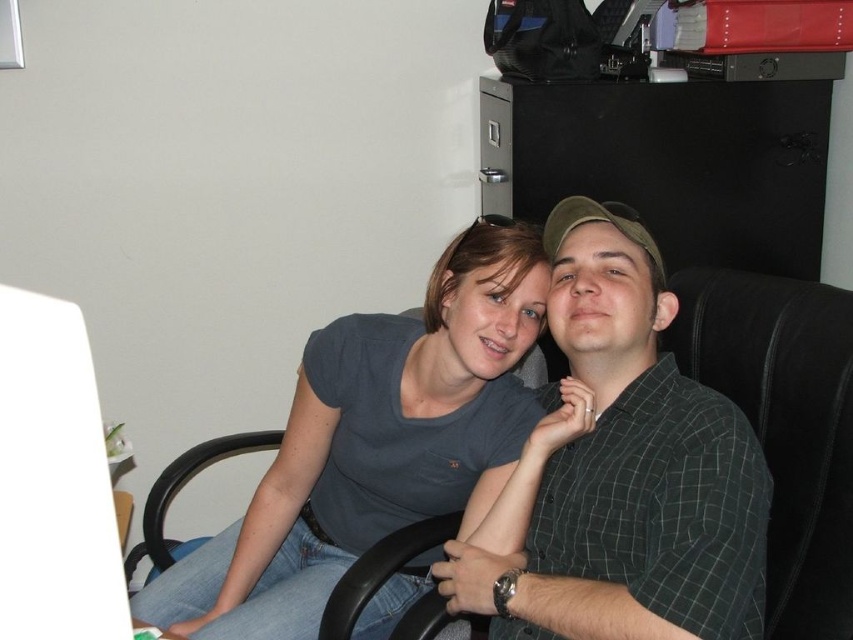
You are standing in the office scene and want to place a small plant between the two points labeled as point [666,632] and point [384,637]. Based on their positions, will the plant be closer to the person on the left or the person on the right?

The plant will be closer to the person on the right because point [666,632] is in front of point [384,637], meaning the latter is further back, so the midpoint between them would be nearer to the front point which is closer to the right person.